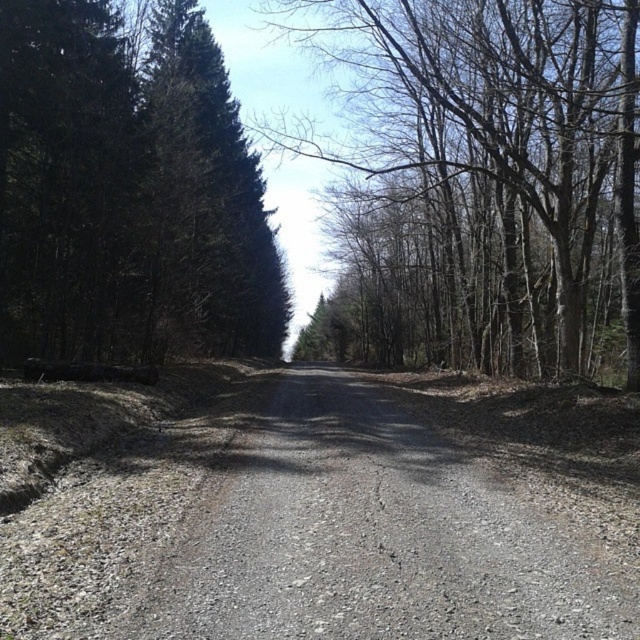
Question: Among these points, which one is nearest to the camera?

Choices:
 (A) (451, 477)
 (B) (516, 330)
 (C) (196, 131)

Answer: (A)

Question: Does gray gravel road at center appear on the right side of dark green textured tree at left?

Choices:
 (A) no
 (B) yes

Answer: (B)

Question: Is bare branches at center bigger than dark green textured tree at left?

Choices:
 (A) no
 (B) yes

Answer: (B)

Question: Which point is closer to the camera?

Choices:
 (A) (476, 637)
 (B) (515, 280)

Answer: (A)

Question: Is bare branches at center below dark green textured tree at left?

Choices:
 (A) no
 (B) yes

Answer: (A)

Question: Among these points, which one is farthest from the camera?

Choices:
 (A) [470, 211]
 (B) [512, 557]

Answer: (A)